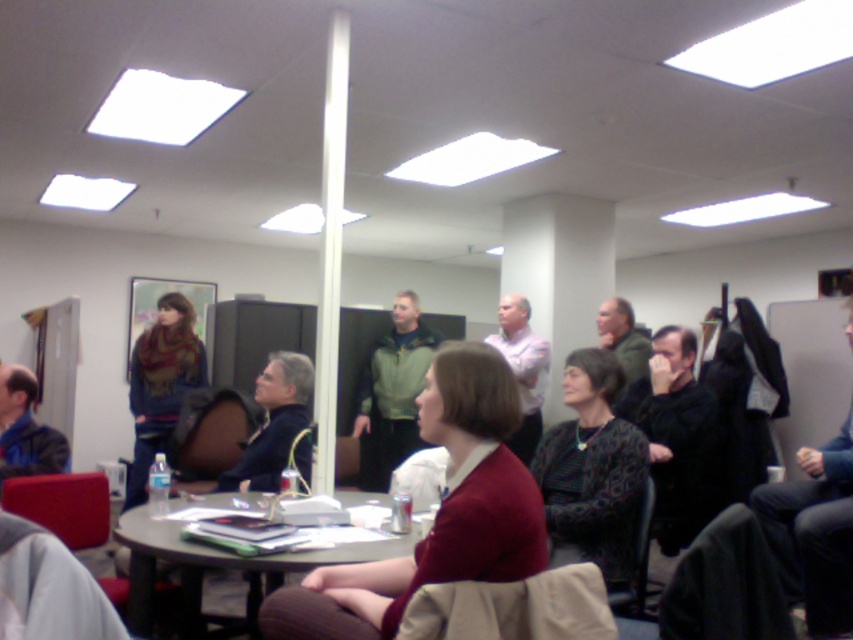
You are sitting at the wooden table at center and want to hand a document to the person in the maroon sweater at center. Since both are at the center, how do you determine which direction to pass the document?

The maroon sweater at center is closer to the viewer than the wooden table at center, so you should pass the document forward towards the person in the maroon sweater at center.